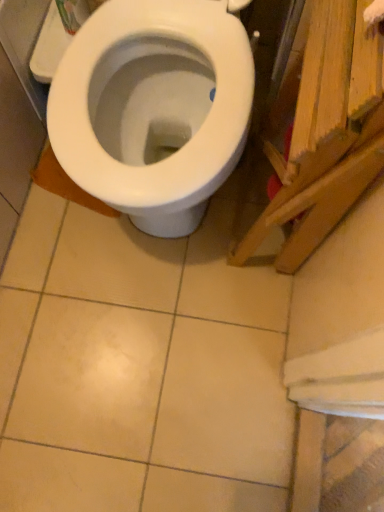
Identify the location of blank area beneath wooden plank at right (from a real-world perspective). This screenshot has width=384, height=512. (253, 219).